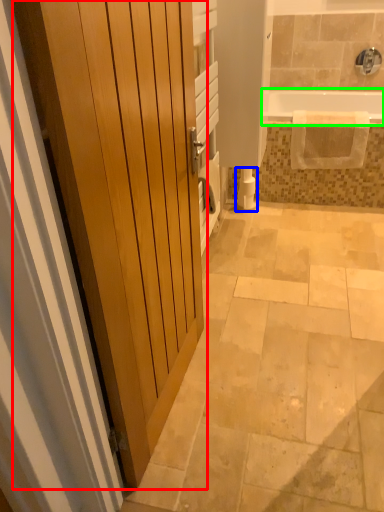
Question: Considering the real-world distances, which object is farthest from door (highlighted by a red box)? toilet paper (highlighted by a blue box) or bathtub (highlighted by a green box)?

Choices:
 (A) toilet paper
 (B) bathtub

Answer: (B)